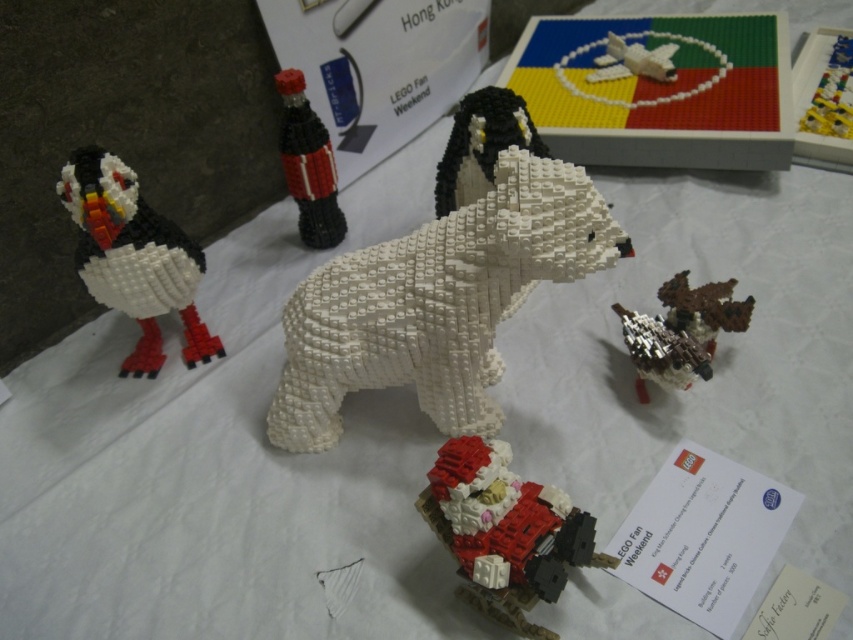
This screenshot has width=853, height=640. I want to click on brick-patterned bird at left, so click(132, 257).

Is brick-patterned bird at left to the left of metallic silver bird at center-right from the viewer's perspective?

Correct, you'll find brick-patterned bird at left to the left of metallic silver bird at center-right.

Where is `brick-patterned bird at left`? This screenshot has height=640, width=853. brick-patterned bird at left is located at coordinates (132, 257).

Is metallic silver bird at center-right thinner than white matte airplane at upper center?

Correct, metallic silver bird at center-right's width is less than white matte airplane at upper center's.

How far apart are metallic silver bird at center-right and white matte airplane at upper center?

They are 27.10 inches apart.

Image resolution: width=853 pixels, height=640 pixels. What do you see at coordinates (660, 353) in the screenshot?
I see `metallic silver bird at center-right` at bounding box center [660, 353].

Find the location of a particular element. The image size is (853, 640). metallic silver bird at center-right is located at coordinates (660, 353).

Does black matte penguin at center appear on the left side of white matte airplane at upper center?

Correct, you'll find black matte penguin at center to the left of white matte airplane at upper center.

Is black matte penguin at center below white matte airplane at upper center?

Yes.

Does point (454, 193) come in front of point (675, 49)?

Yes.

Locate an element on the screen. black matte penguin at center is located at coordinates (480, 145).